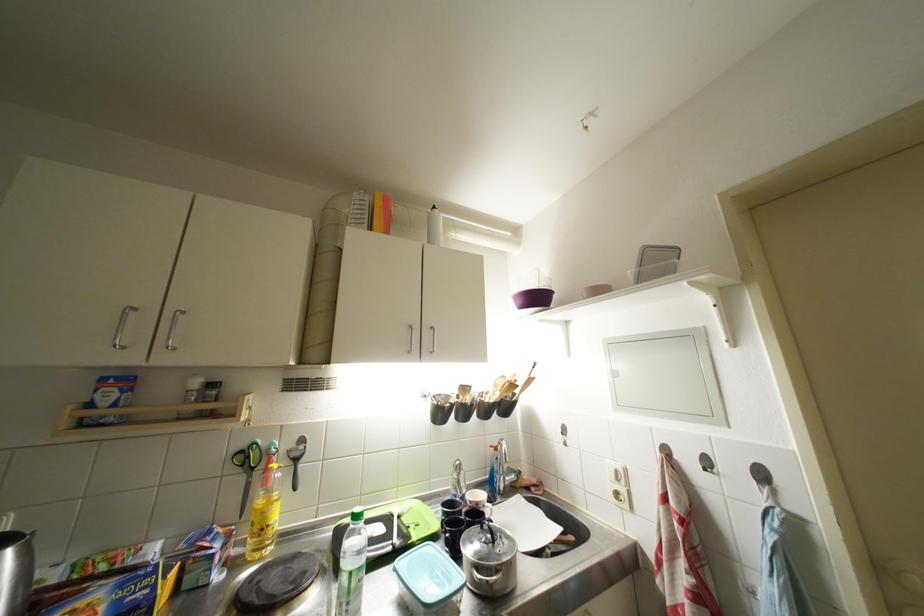
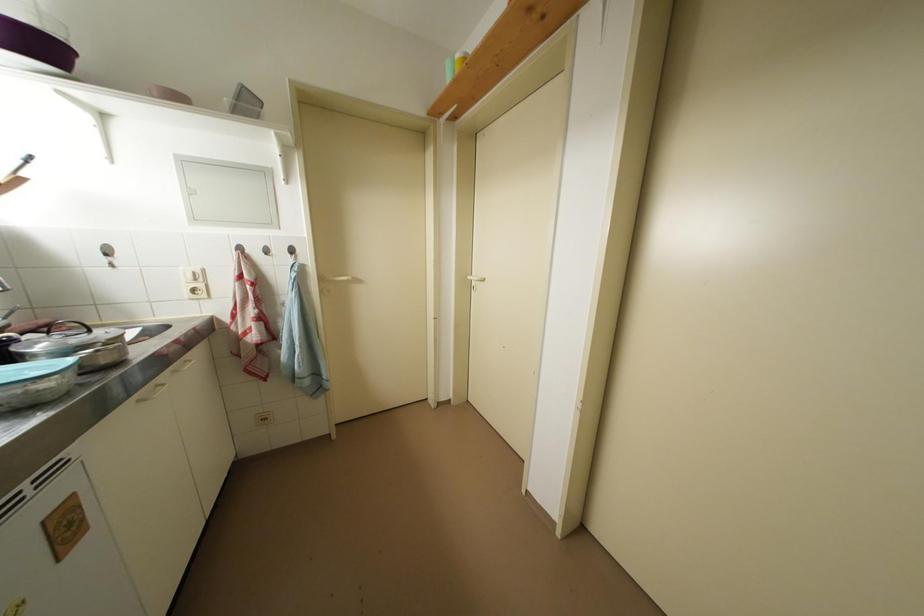
The point at (623, 476) is marked in the first image. Where is the corresponding point in the second image?

(201, 277)